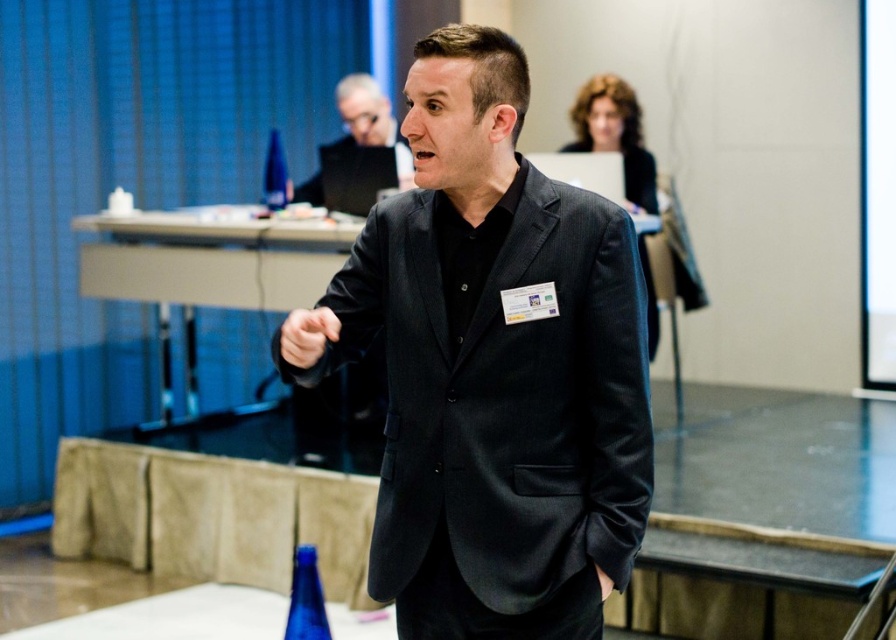
What are the coordinates of the matte black suit at center?

The coordinates of the matte black suit at center are approximately 0.573 on the x axis and 0.550 on the y axis.